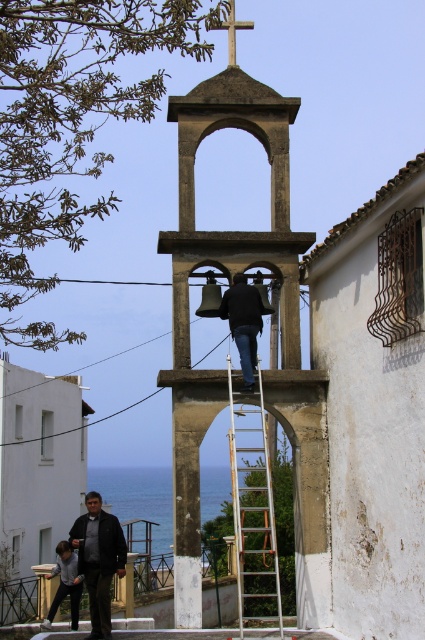
You are a maintenance worker who needs to reach the top of the white metallic ladder at center to inspect the bell. However, you are wearing the dark gray jacket at lower left. Will your jacket interfere with climbing the ladder?

The white metallic ladder at center is taller than the dark gray jacket at lower left, so the jacket will not interfere with climbing the ladder since it is shorter than the ladder.

You are a maintenance worker who needs to reach the top of the white metallic ladder at center to inspect the bell tower. However, you notice the dark gray jacket at lower left nearby. Where should you place the jacket to avoid it being in the way while climbing?

The white metallic ladder at center is located above the dark gray jacket at lower left. To avoid the jacket being in the way, move it to a position below or to the side of the ladder where it won t interfere with your climb.